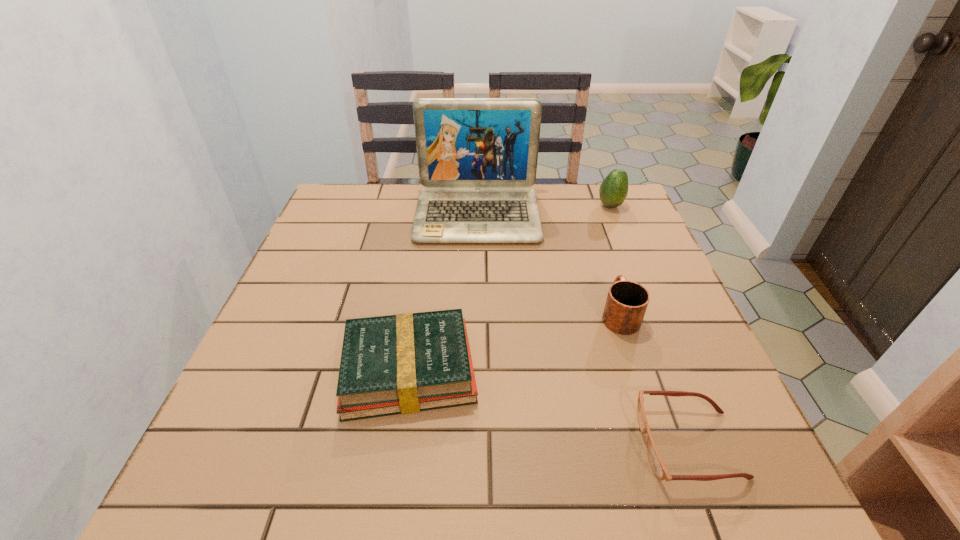
This screenshot has height=540, width=960. Find the location of `the tallest object`. the tallest object is located at coordinates (477, 157).

You are a GUI agent. You are given a task and a screenshot of the screen. Output one action in this format:
    pyautogui.click(x=<x>, y=<y>)
    Task: Click on the avocado
    
    Given the screenshot: What is the action you would take?
    pyautogui.click(x=613, y=191)

At what (x,y) coordinates should I click in order to perform the action: click on the third tallest object. Please return your answer as a coordinate pair (x, y). The height and width of the screenshot is (540, 960). Looking at the image, I should click on (627, 301).

Where is `the second shortest object`? Image resolution: width=960 pixels, height=540 pixels. the second shortest object is located at coordinates (405, 363).

Where is `spectacles`? Image resolution: width=960 pixels, height=540 pixels. spectacles is located at coordinates [658, 466].

This screenshot has width=960, height=540. What are the coordinates of `vacant space located 0.180m on the screen of the laptop computer` in the screenshot? It's located at (477, 291).

I want to click on free spot located 0.120m on the front of the second tallest object, so click(x=623, y=237).

Identify the location of free space located 0.340m on the side of the mug with the handle. Image resolution: width=960 pixels, height=540 pixels. (587, 215).

What are the coordinates of `vacant region located on the side of the mug with the handle` in the screenshot? It's located at (585, 209).

The height and width of the screenshot is (540, 960). I want to click on free location located 0.060m on the side of the mug with the handle, so click(607, 278).